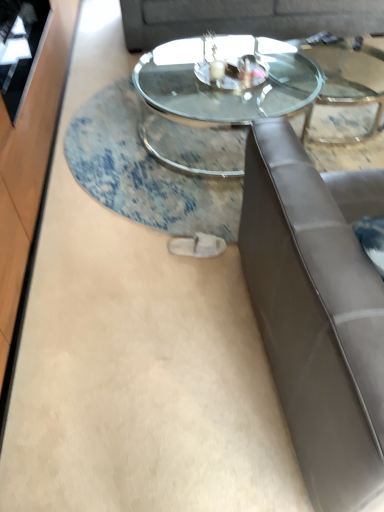
Question: From the image's perspective, is transparent glass coffee table at center below suede gray couch at upper center?

Choices:
 (A) yes
 (B) no

Answer: (A)

Question: Is transparent glass coffee table at center positioned far away from suede gray couch at upper center?

Choices:
 (A) yes
 (B) no

Answer: (B)

Question: Can you confirm if transparent glass coffee table at center is thinner than suede gray couch at upper center?

Choices:
 (A) yes
 (B) no

Answer: (B)

Question: Could you tell me if transparent glass coffee table at center is turned towards suede gray couch at upper center?

Choices:
 (A) yes
 (B) no

Answer: (B)

Question: Is the position of transparent glass coffee table at center more distant than that of suede gray couch at upper center?

Choices:
 (A) yes
 (B) no

Answer: (B)

Question: Is transparent glass coffee table at center at the left side of suede gray couch at upper center?

Choices:
 (A) no
 (B) yes

Answer: (B)

Question: Are transparent glass coffee table at center and satin brown leather studio couch at right making contact?

Choices:
 (A) no
 (B) yes

Answer: (A)

Question: From the image's perspective, is transparent glass coffee table at center below satin brown leather studio couch at right?

Choices:
 (A) no
 (B) yes

Answer: (A)

Question: Is transparent glass coffee table at center bigger than satin brown leather studio couch at right?

Choices:
 (A) yes
 (B) no

Answer: (B)

Question: Is transparent glass coffee table at center smaller than satin brown leather studio couch at right?

Choices:
 (A) no
 (B) yes

Answer: (B)

Question: Is transparent glass coffee table at center outside of satin brown leather studio couch at right?

Choices:
 (A) no
 (B) yes

Answer: (B)

Question: Could you tell me if transparent glass coffee table at center is turned towards satin brown leather studio couch at right?

Choices:
 (A) no
 (B) yes

Answer: (A)

Question: Are transparent glass door at left and transparent glass coffee table at center located far from each other?

Choices:
 (A) yes
 (B) no

Answer: (A)